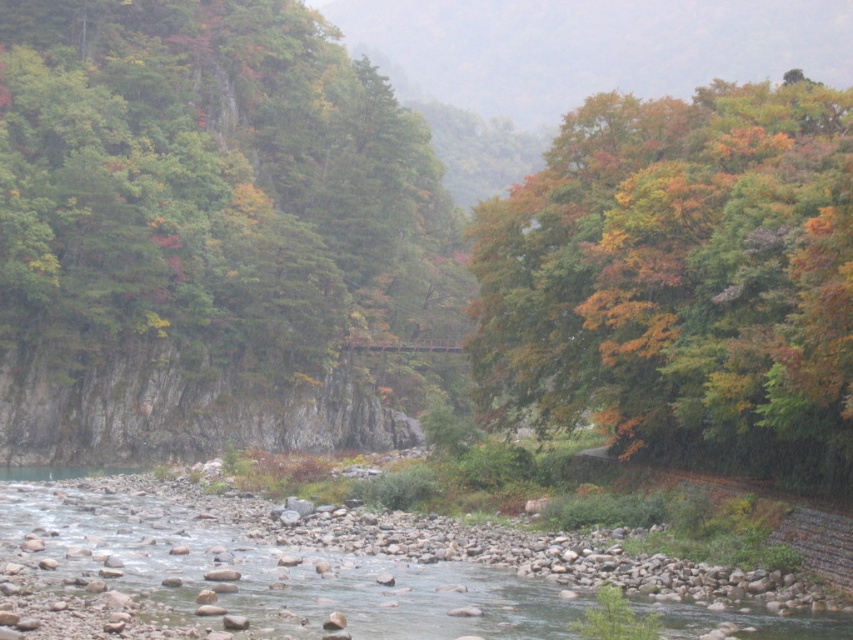
You are planning to install a small footbridge over the river in the image. The footbridge needs to span the distance between the green matte tree at upper left and the multicolored foliage at upper right. Given that the footbridge can only support a maximum span of 250 feet, will it be able to safely connect these two points?

The distance between the green matte tree at upper left and the multicolored foliage at upper right is 263.07 feet, which exceeds the footbridge maximum span of 250 feet. Therefore, the footbridge will not be able to safely connect these two points.

You are an observer standing at the riverbank. You notice the green matte tree at upper left and the multicolored foliage at upper right. Which one is closer to you?

The green matte tree at upper left is closer to you because it is in front of the multicolored foliage at upper right.